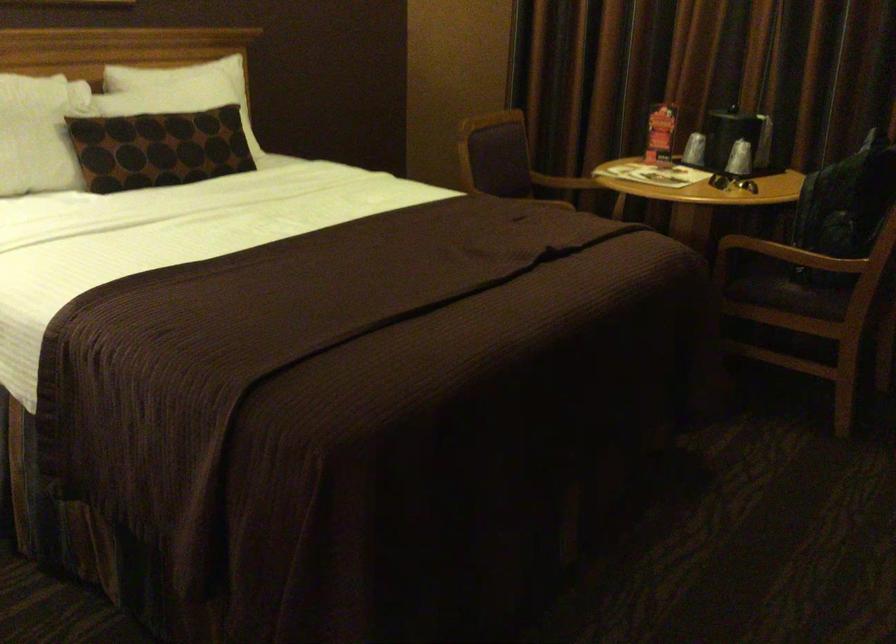
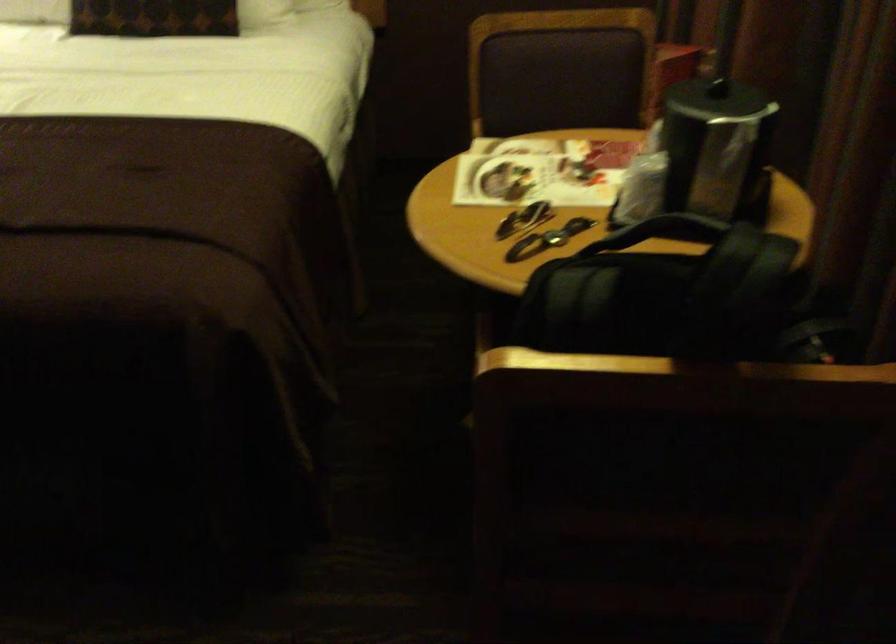
Locate, in the second image, the point that corresponds to point 510,171 in the first image.

(553, 113)